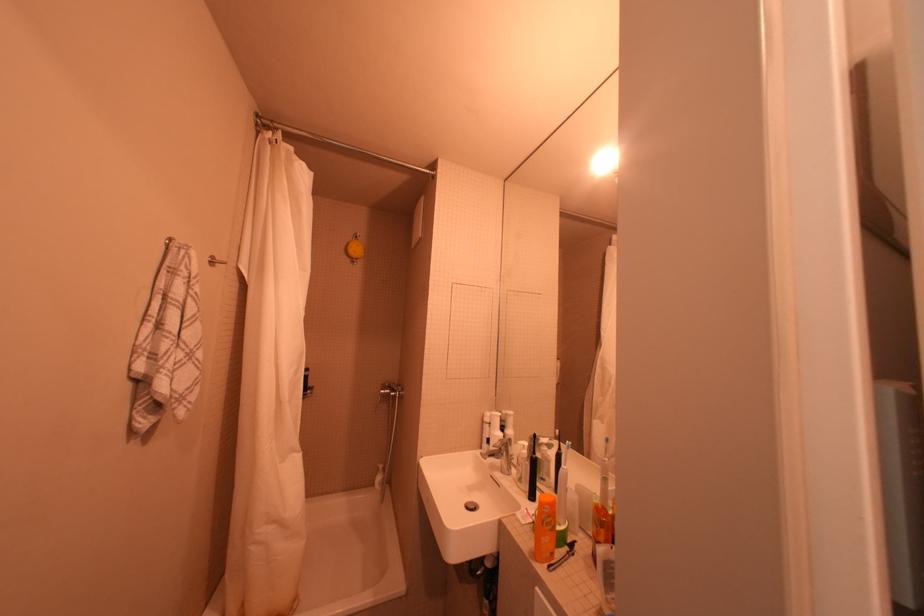
Which object does [336,145] point to?

This point indicates the silver towel rack.